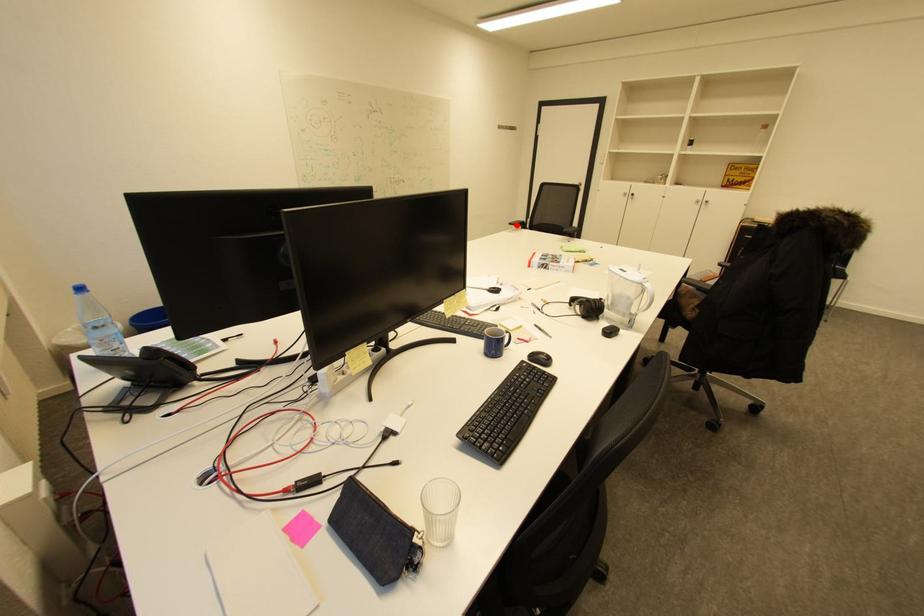
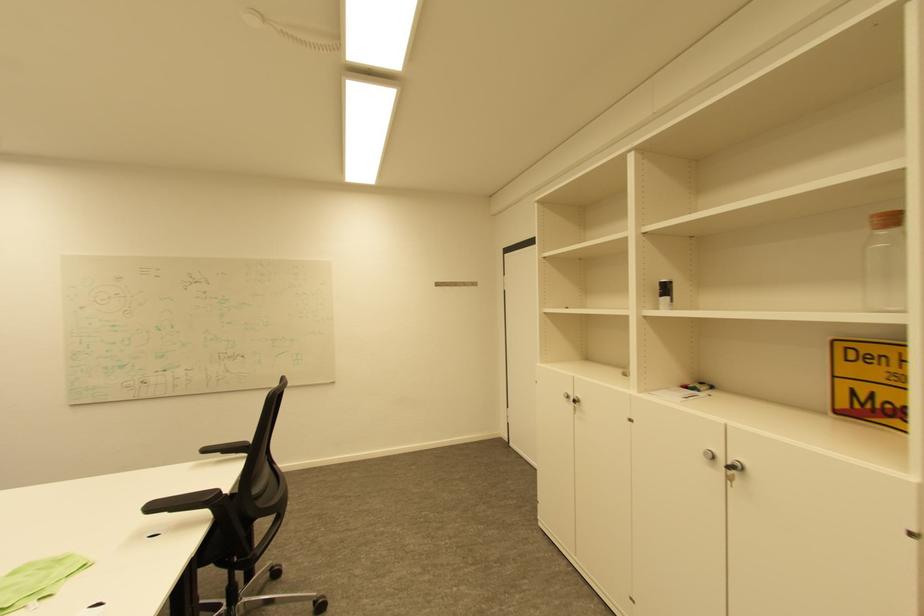
Where in the second image is the point corresponding to the highlighted location from the first image?

(213, 450)